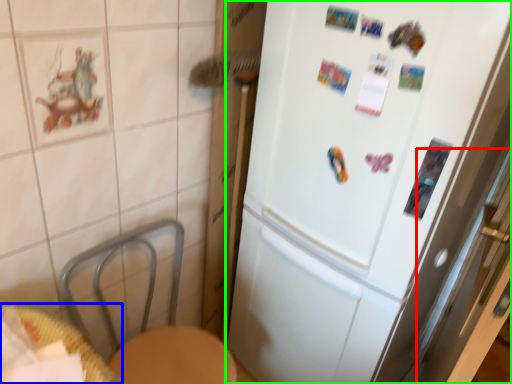
Question: Which object is positioned closest to screen door (highlighted by a red box)? Select from table (highlighted by a blue box) and refrigerator (highlighted by a green box).

Choices:
 (A) table
 (B) refrigerator

Answer: (B)